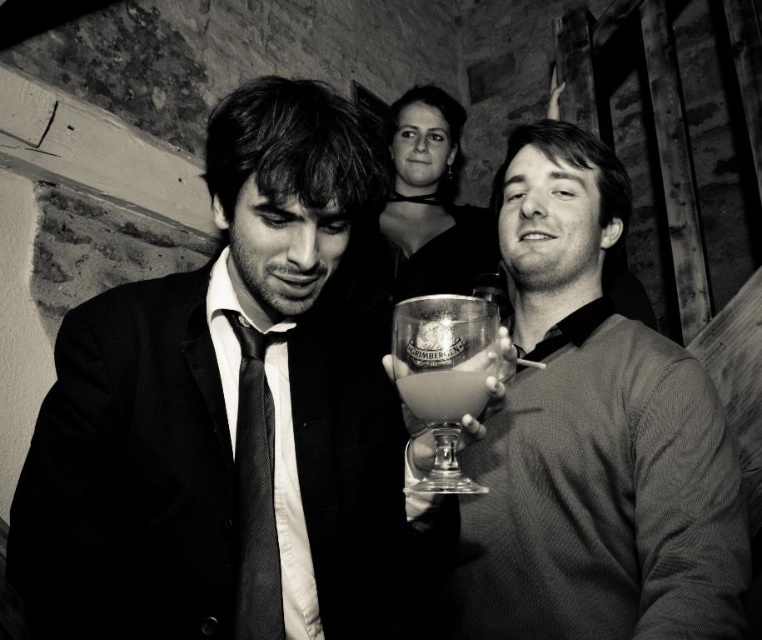
Question: Among these objects, which one is nearest to the camera?

Choices:
 (A) transparent glass goblet at center
 (B) smooth glass goblet at center
 (C) black textured tie at center
 (D) matte black suit at center

Answer: (A)

Question: Is matte black suit at center to the right of smooth glass goblet at center from the viewer's perspective?

Choices:
 (A) no
 (B) yes

Answer: (A)

Question: Can you confirm if smooth glass goblet at center is wider than black textured tie at center?

Choices:
 (A) yes
 (B) no

Answer: (A)

Question: Which of the following is the farthest from the observer?

Choices:
 (A) black textured tie at center
 (B) matte black suit at center
 (C) transparent glass goblet at center
 (D) translucent glass goblet at center

Answer: (A)

Question: Can you confirm if matte black suit at center is bigger than black textured tie at center?

Choices:
 (A) yes
 (B) no

Answer: (A)

Question: Which of the following is the farthest from the observer?

Choices:
 (A) (114, 572)
 (B) (735, 513)
 (C) (424, 403)

Answer: (B)